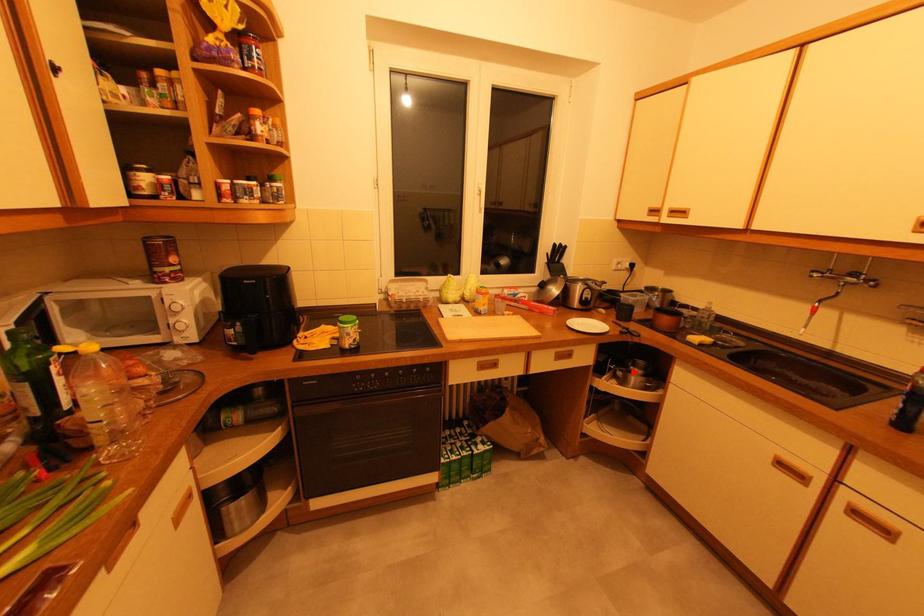
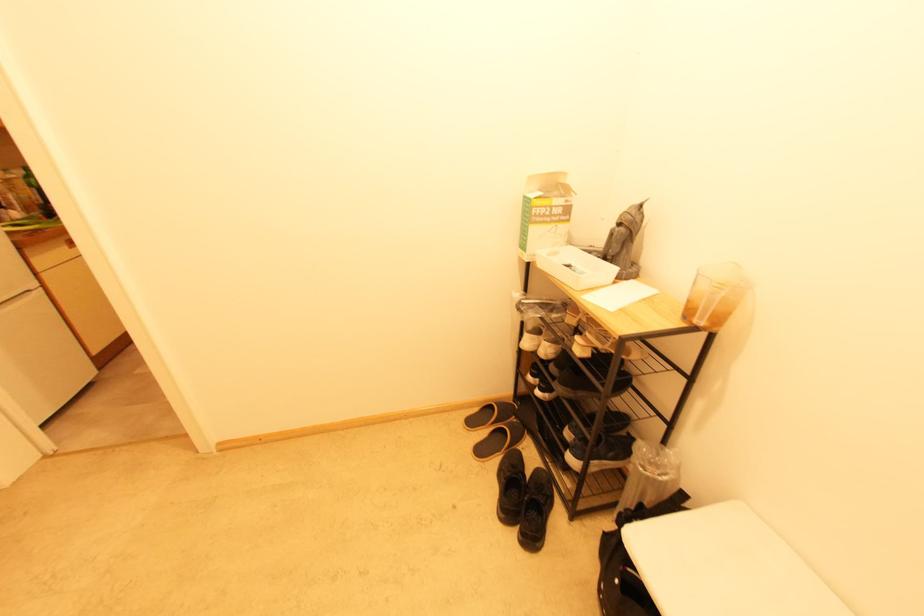
Question: I am providing you with two images of the same scene from different viewpoints. A red point is marked on the first image. At the location where the point appears in image 1, is it still visible in image 2?

Choices:
 (A) Yes
 (B) No

Answer: (B)